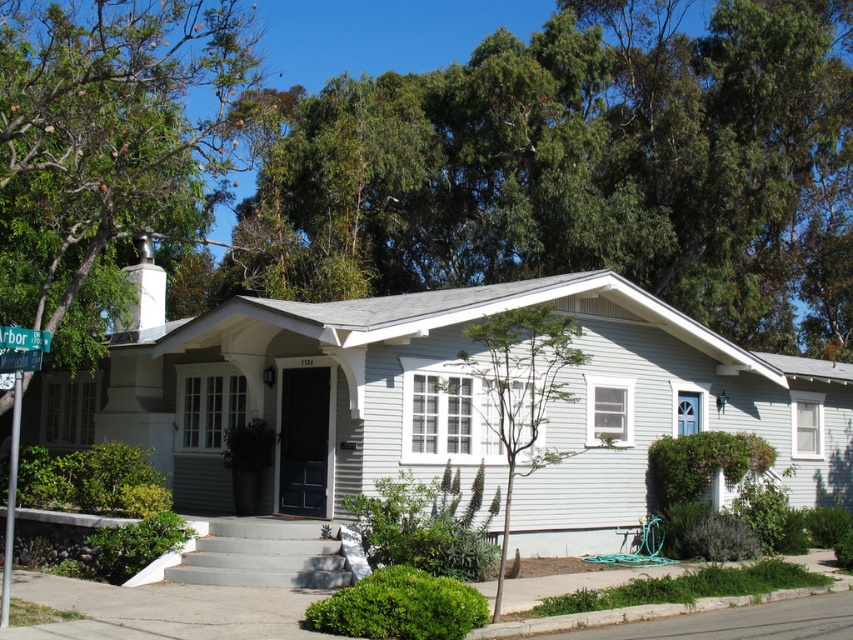
Question: Is green leafy tree at upper center below green leafy tree at center?

Choices:
 (A) yes
 (B) no

Answer: (B)

Question: Is green leafy tree at upper center smaller than green plastic street sign at left?

Choices:
 (A) no
 (B) yes

Answer: (A)

Question: In this image, where is green leafy tree at center located relative to green plastic street sign at upper left?

Choices:
 (A) below
 (B) above

Answer: (A)

Question: Among these points, which one is nearest to the camera?

Choices:
 (A) (26, 355)
 (B) (482, 317)

Answer: (A)

Question: Which of the following is the farthest from the observer?

Choices:
 (A) green plastic street sign at left
 (B) green leafy tree at upper center

Answer: (B)

Question: Which point is farther from the camera taking this photo?

Choices:
 (A) (683, 211)
 (B) (494, 604)
 (C) (10, 369)
 (D) (0, 330)

Answer: (A)